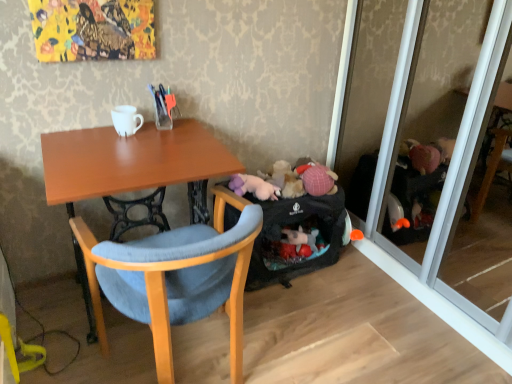
Question: From the image's perspective, relative to black fabric luggage at lower right, is transparent glass screen door at right above or below?

Choices:
 (A) below
 (B) above

Answer: (B)

Question: Based on their sizes in the image, would you say transparent glass screen door at right is bigger or smaller than black fabric luggage at lower right?

Choices:
 (A) big
 (B) small

Answer: (A)

Question: Which of these objects is positioned farthest from the transparent glass screen door at right?

Choices:
 (A) wooden table at center
 (B) wooden chair at center
 (C) black fabric luggage at lower right
 (D) white glossy coffee cup at upper center

Answer: (D)

Question: Based on their relative distances, which object is nearer to the wooden table at center?

Choices:
 (A) wooden chair at center
 (B) white glossy coffee cup at upper center
 (C) transparent glass screen door at right
 (D) black fabric luggage at lower right

Answer: (B)